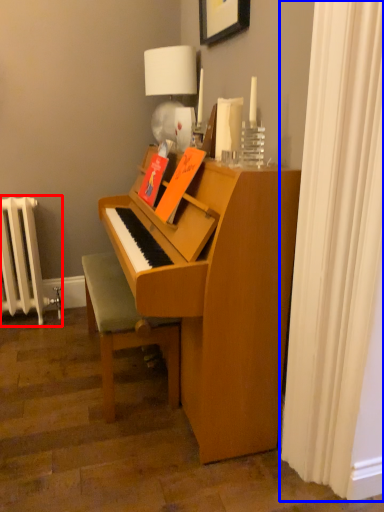
Question: Which object appears farthest to the camera in this image, radiator (highlighted by a red box) or shower curtain (highlighted by a blue box)?

Choices:
 (A) radiator
 (B) shower curtain

Answer: (A)